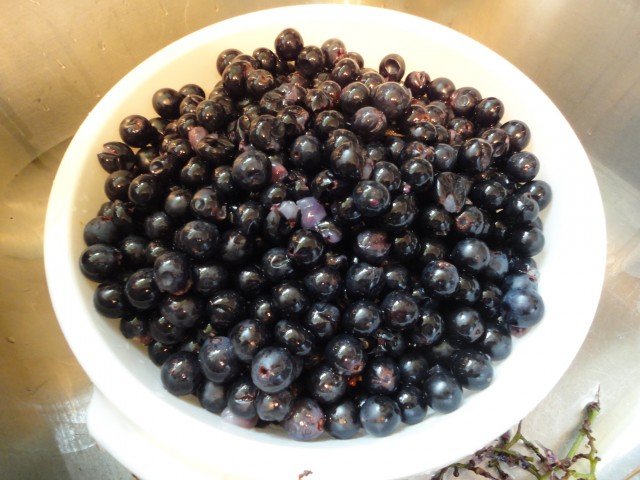
Find the location of `sink`. sink is located at coordinates (43, 403).